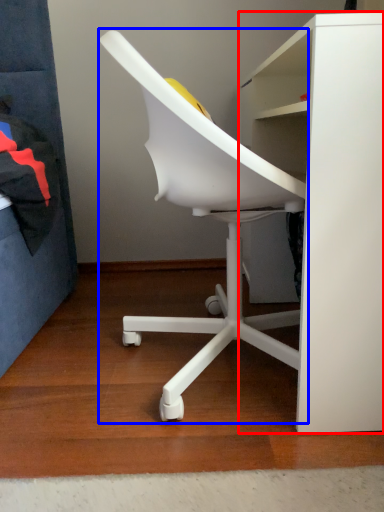
Question: Among these objects, which one is farthest to the camera, desk (highlighted by a red box) or chair (highlighted by a blue box)?

Choices:
 (A) desk
 (B) chair

Answer: (B)